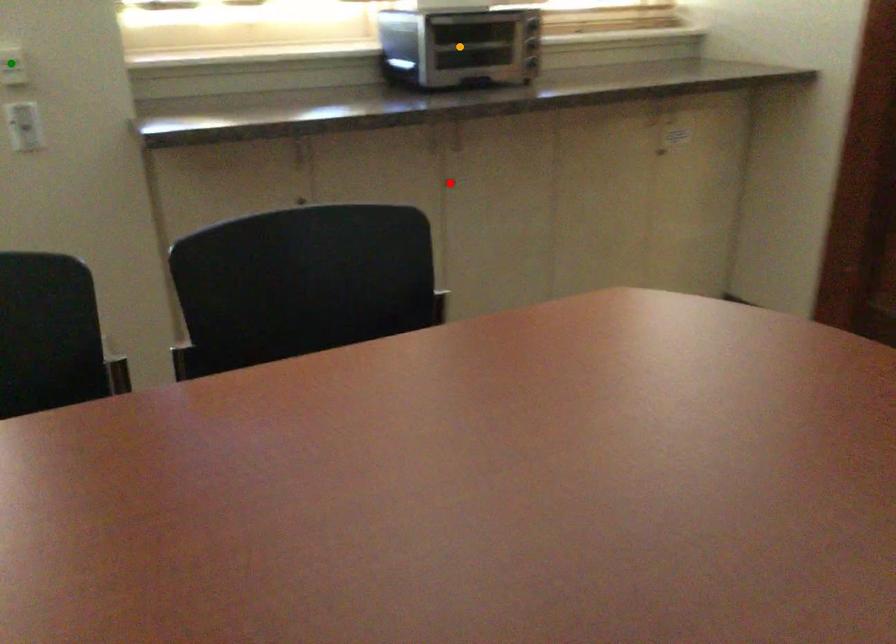
Order these from farthest to nearest:
red point
green point
orange point

red point → orange point → green point